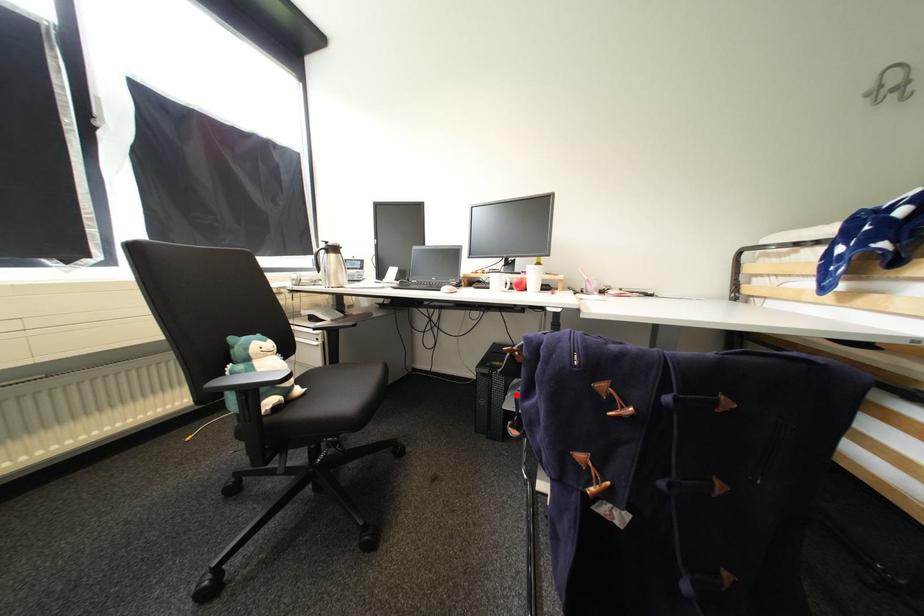
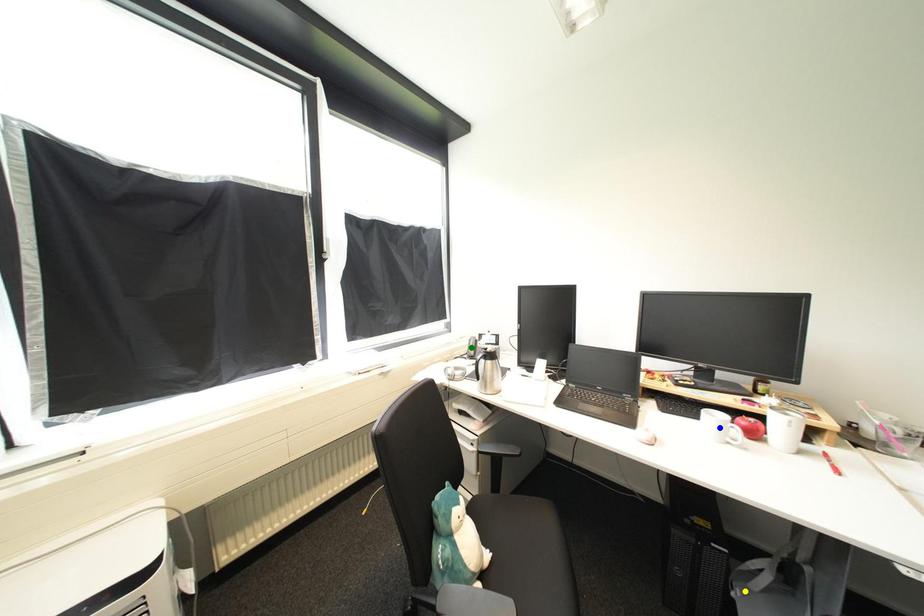
Question: I am providing you with two images of the same scene from different viewpoints. A red point is marked on the first image. You are given multiple points on the second image. In image 2, which mark is for the same physical point as the one in image 1?

Choices:
 (A) yellow point
 (B) green point
 (C) blue point

Answer: (A)